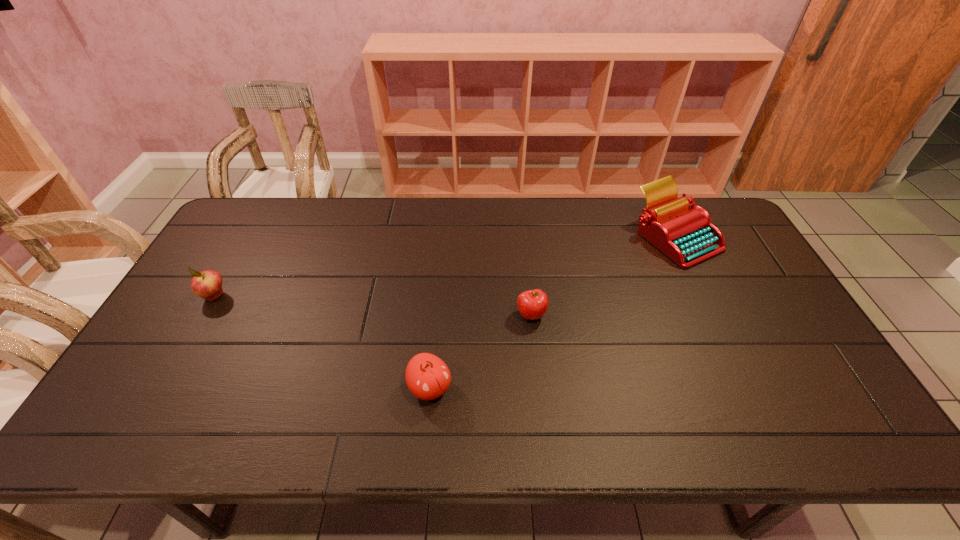
Identify the location of vacant space that is in between the nearest object and the shortest apple. The image size is (960, 540). (481, 352).

Locate an element on the screen. The height and width of the screenshot is (540, 960). unoccupied area between the rightmost object and the second object from right to left is located at coordinates (604, 276).

In order to click on object that is the second closest one to the shortest object in this screenshot , I will do `click(687, 236)`.

I want to click on object identified as the second closest to the third object from left to right, so click(x=687, y=236).

Image resolution: width=960 pixels, height=540 pixels. What are the coordinates of `the second closest apple to the tallest object` in the screenshot? It's located at (427, 376).

Locate an element on the screen. The image size is (960, 540). apple that stands as the closest to the tallest object is located at coordinates (533, 304).